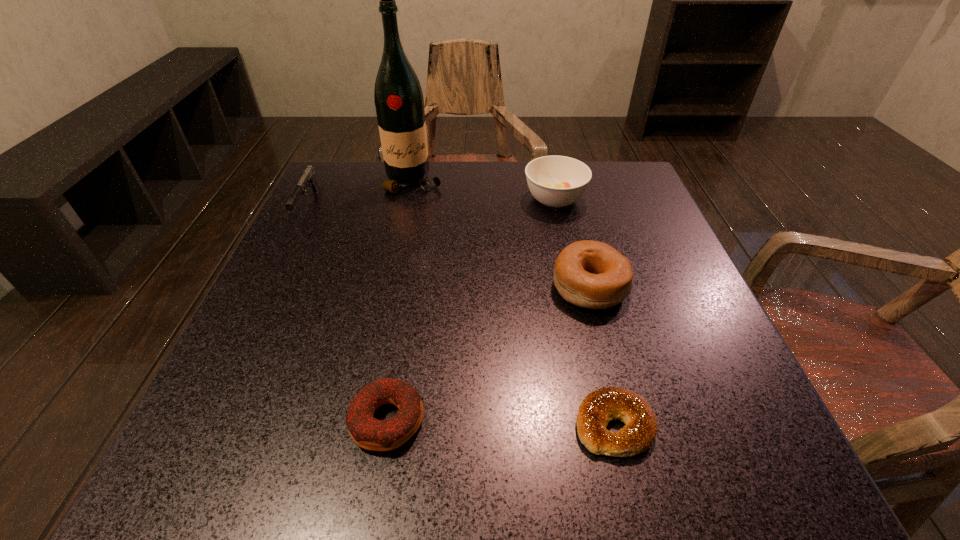
The width and height of the screenshot is (960, 540). Find the location of `the tallest object`. the tallest object is located at coordinates (399, 102).

I want to click on soup bowl, so click(x=556, y=181).

Find the location of a particular element. gun is located at coordinates (308, 177).

Identify the location of the taller bagel. (591, 274).

You are a GUI agent. You are given a task and a screenshot of the screen. Output one action in this format:
    pyautogui.click(x=<x>, y=<y>)
    Task: Click on the farther bagel
    The width and height of the screenshot is (960, 540).
    Given the screenshot: What is the action you would take?
    pyautogui.click(x=591, y=274)

The image size is (960, 540). What are the coordinates of `doughnut` in the screenshot? It's located at (369, 433).

Locate an element on the screen. the shorter bagel is located at coordinates (598, 408).

Find the location of a particular element. the shortest object is located at coordinates (598, 408).

Where is `free space located 0.350m on the right of the tallest object`? This screenshot has width=960, height=540. free space located 0.350m on the right of the tallest object is located at coordinates (584, 181).

Find the location of a particular element. vacant region located on the front of the soup bowl is located at coordinates (588, 346).